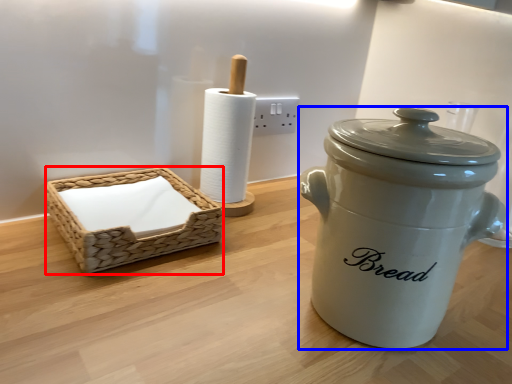
Question: Which of the following is the farthest to the observer, basket (highlighted by a red box) or crock pot (highlighted by a blue box)?

Choices:
 (A) basket
 (B) crock pot

Answer: (A)